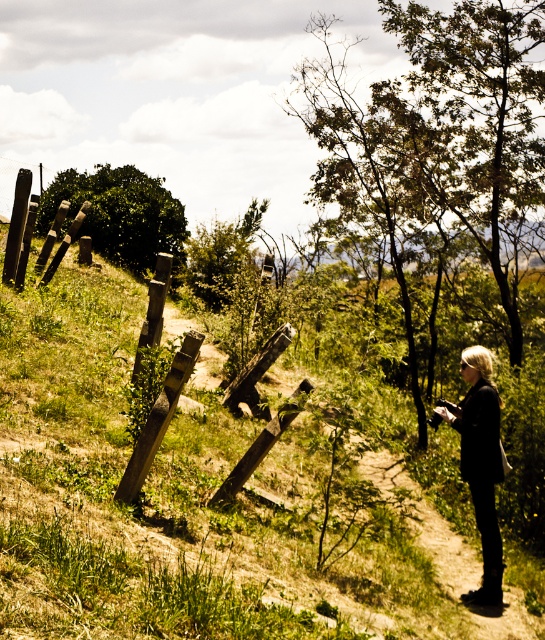
Is point (46, 204) positioned in front of point (492, 572)?

No, it is behind (492, 572).

Which of these two, green leafy tree at upper left or black leather jacket at lower right, stands shorter?

black leather jacket at lower right

Locate an element on the screen. The width and height of the screenshot is (545, 640). green leafy tree at upper left is located at coordinates (119, 214).

Is green leafy tree at right taller than black leather jacket at lower right?

Indeed, green leafy tree at right has a greater height compared to black leather jacket at lower right.

The width and height of the screenshot is (545, 640). I want to click on green leafy tree at right, so click(439, 150).

Which is in front, point (540, 81) or point (445, 410)?

Point (445, 410)

Identify the location of green leafy tree at right. (439, 150).

The image size is (545, 640). Describe the element at coordinates (439, 150) in the screenshot. I see `green leafy tree at right` at that location.

Which of these two, green leafy tree at right or green leafy tree at upper left, stands taller?

Standing taller between the two is green leafy tree at right.

This screenshot has width=545, height=640. Find the location of `green leafy tree at right`. green leafy tree at right is located at coordinates (439, 150).